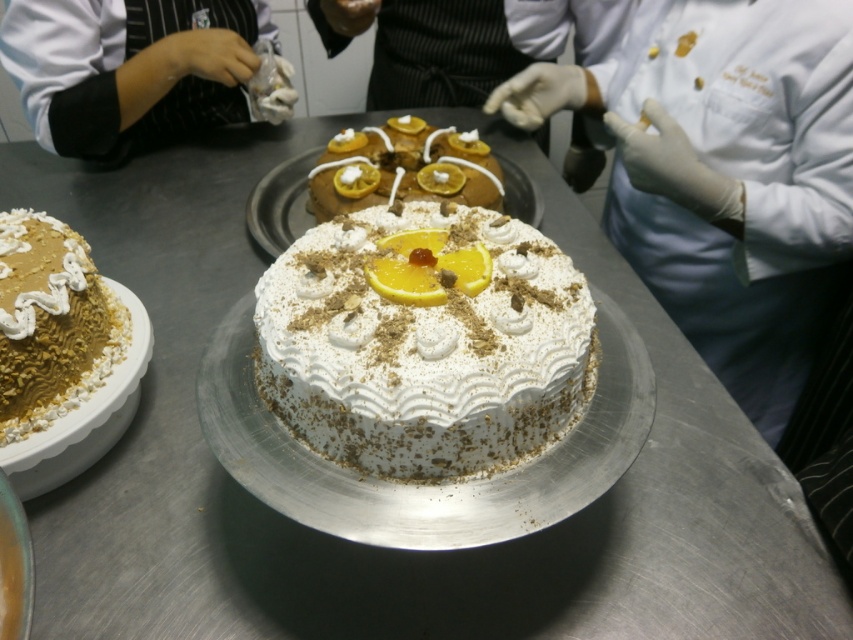
Who is shorter, white chef coat at center or white cream cake at center?

white cream cake at center is shorter.

This screenshot has height=640, width=853. What do you see at coordinates (724, 176) in the screenshot?
I see `white chef coat at center` at bounding box center [724, 176].

Does point (662, 136) lie in front of point (450, 404)?

No, it is behind (450, 404).

In order to click on white chef coat at center in this screenshot , I will do `click(724, 176)`.

Does golden textured dome at left have a smaller size compared to glazed orange cake at center?

Yes, golden textured dome at left is smaller than glazed orange cake at center.

Can you confirm if golden textured dome at left is wider than glazed orange cake at center?

No.

Is point (85, 381) positioned in front of point (415, 150)?

Yes, point (85, 381) is closer to viewer.

What are the coordinates of `golden textured dome at left` in the screenshot? It's located at (51, 323).

Does white chef coat at center appear on the right side of glazed orange cake at center?

Yes, white chef coat at center is to the right of glazed orange cake at center.

Is point (706, 163) more distant than point (401, 177)?

Yes, point (706, 163) is farther from viewer.

Is point (724, 163) positioned in front of point (334, 164)?

No, (724, 163) is further to viewer.

Image resolution: width=853 pixels, height=640 pixels. In order to click on white chef coat at center in this screenshot , I will do `click(724, 176)`.